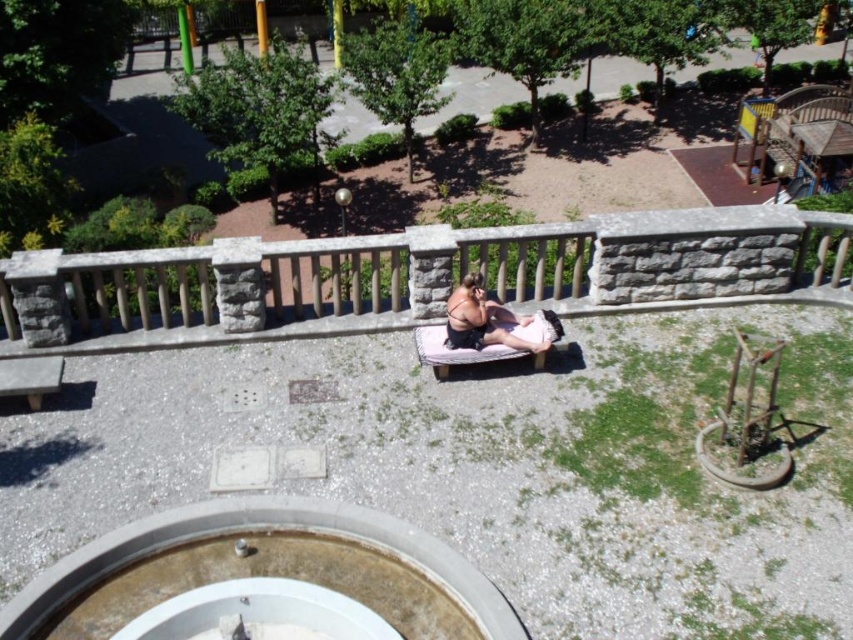
Question: Does stone balustrade at center lie in front of dark pink fabric at center?

Choices:
 (A) no
 (B) yes

Answer: (B)

Question: Among these points, which one is farthest from the camera?

Choices:
 (A) 532,346
 (B) 99,298

Answer: (B)

Question: Which point is farther to the camera?

Choices:
 (A) (648, 257)
 (B) (547, 344)

Answer: (A)

Question: Which point appears farthest from the camera in this image?

Choices:
 (A) [76, 291]
 (B) [489, 344]

Answer: (A)

Question: Can you confirm if stone balustrade at center is positioned above dark pink fabric at center?

Choices:
 (A) yes
 (B) no

Answer: (A)

Question: From the image, what is the correct spatial relationship of stone balustrade at center in relation to dark pink fabric at center?

Choices:
 (A) below
 (B) above

Answer: (B)